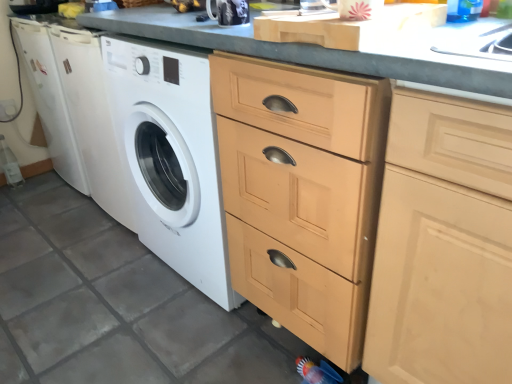
Question: Is light wood cabinet at center next to glossy ceramic mug at upper center and touching it?

Choices:
 (A) no
 (B) yes

Answer: (A)

Question: Considering the relative positions of light wood cabinet at center and glossy ceramic mug at upper center in the image provided, is light wood cabinet at center in front of glossy ceramic mug at upper center?

Choices:
 (A) yes
 (B) no

Answer: (A)

Question: From a real-world perspective, is light wood cabinet at center beneath glossy ceramic mug at upper center?

Choices:
 (A) yes
 (B) no

Answer: (A)

Question: Considering the relative sizes of light wood cabinet at center and glossy ceramic mug at upper center in the image provided, is light wood cabinet at center taller than glossy ceramic mug at upper center?

Choices:
 (A) yes
 (B) no

Answer: (A)

Question: Is glossy ceramic mug at upper center inside light wood cabinet at center?

Choices:
 (A) no
 (B) yes

Answer: (A)

Question: Could you tell me if light wood cabinet at center is turned towards glossy ceramic mug at upper center?

Choices:
 (A) yes
 (B) no

Answer: (B)

Question: Can you confirm if glossy ceramic mug at upper center is bigger than light wood cabinet at center?

Choices:
 (A) yes
 (B) no

Answer: (B)

Question: Can you confirm if glossy ceramic mug at upper center is smaller than light wood cabinet at center?

Choices:
 (A) yes
 (B) no

Answer: (A)

Question: Considering the relative sizes of glossy ceramic mug at upper center and light wood cabinet at center in the image provided, is glossy ceramic mug at upper center wider than light wood cabinet at center?

Choices:
 (A) yes
 (B) no

Answer: (B)

Question: Is glossy ceramic mug at upper center with light wood cabinet at center?

Choices:
 (A) yes
 (B) no

Answer: (B)

Question: Does glossy ceramic mug at upper center appear on the left side of light wood cabinet at center?

Choices:
 (A) no
 (B) yes

Answer: (B)

Question: Does glossy ceramic mug at upper center have a lesser height compared to light wood cabinet at center?

Choices:
 (A) no
 (B) yes

Answer: (B)

Question: Considering the positions of point (221, 0) and point (460, 160), is point (221, 0) closer or farther from the camera than point (460, 160)?

Choices:
 (A) closer
 (B) farther

Answer: (B)